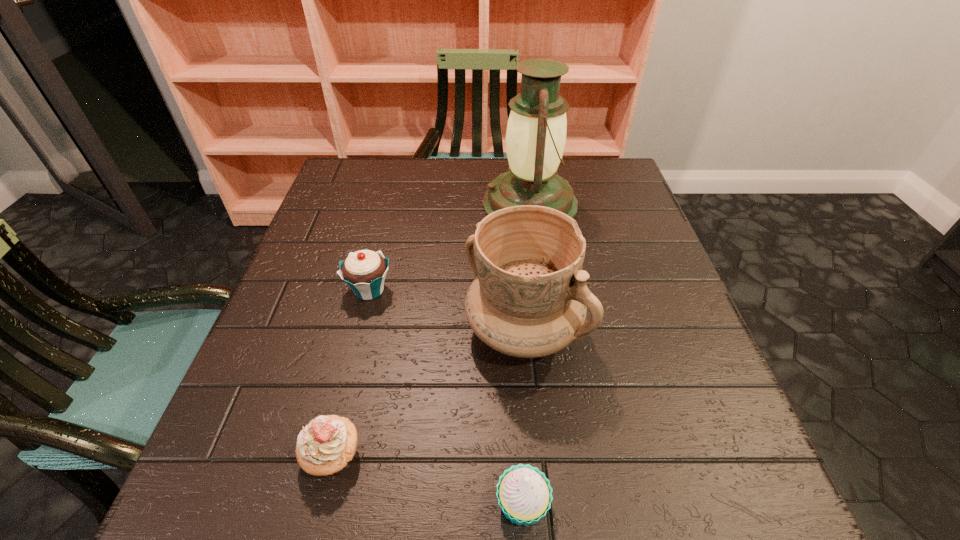
Where is `the tallest object`? The image size is (960, 540). the tallest object is located at coordinates (536, 130).

At what (x,y) coordinates should I click in order to perform the action: click on the farthest object. Please return your answer as a coordinate pair (x, y). The image size is (960, 540). Looking at the image, I should click on (536, 130).

Locate an element on the screen. pottery is located at coordinates (529, 299).

Find the location of a particular element. The height and width of the screenshot is (540, 960). the farthest cupcake is located at coordinates pos(364,271).

Where is `the shortest object`? the shortest object is located at coordinates (524, 494).

Locate an element on the screen. The width and height of the screenshot is (960, 540). the shortest cupcake is located at coordinates (524, 494).

Identify the location of vacant space located 0.160m with the light compartment facing forward on the farthest object. The height and width of the screenshot is (540, 960). (420, 204).

At what (x,y) coordinates should I click in order to perform the action: click on vacant point located 0.060m with the light compartment facing forward on the farthest object. Please return your answer as a coordinate pair (x, y). Looking at the image, I should click on (459, 204).

Identify the location of blank area located 0.320m with the light compartment facing forward on the farthest object. Image resolution: width=960 pixels, height=540 pixels. (357, 204).

Where is `free space located 0.390m on the back of the fourth shortest object`? free space located 0.390m on the back of the fourth shortest object is located at coordinates (511, 186).